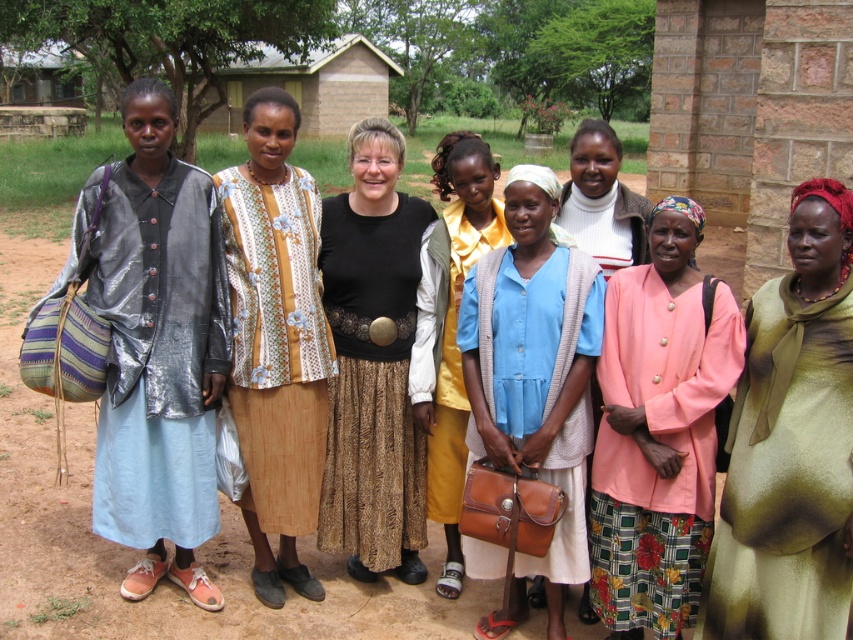
Who is lower down, printed fabric blouse at center or light blue denim shirt at center?

printed fabric blouse at center is lower down.

Who is more distant from viewer, (248, 368) or (436, 401)?

The point (436, 401) is more distant.

Which is behind, point (299, 113) or point (431, 352)?

The point (431, 352) is behind.

Where is `printed fabric blouse at center`? printed fabric blouse at center is located at coordinates (276, 340).

Is pink fabric coat at center bigger than blue fabric shirt at center?

Incorrect, pink fabric coat at center is not larger than blue fabric shirt at center.

Based on the photo, does pink fabric coat at center appear under blue fabric shirt at center?

Yes, pink fabric coat at center is below blue fabric shirt at center.

Is point (628, 557) positioned behind point (552, 173)?

No.

In order to click on pink fabric coat at center in this screenshot , I will do `click(659, 429)`.

Is point (144, 412) positioned after point (712, 589)?

Yes.

You are a GUI agent. You are given a task and a screenshot of the screen. Output one action in this format:
    pyautogui.click(x=<x>, y=<y>)
    Task: Click on the shiny metallic jacket at left
    
    Given the screenshot: What is the action you would take?
    pyautogui.click(x=155, y=346)